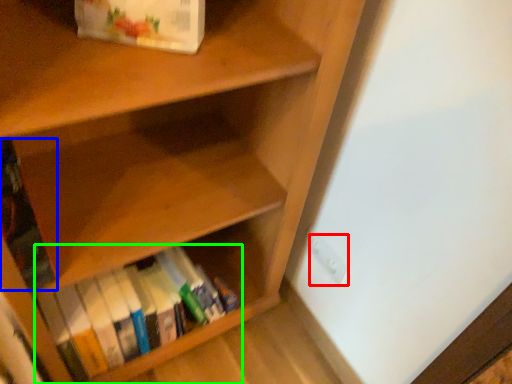
Question: Considering the real-world distances, which object is farthest from electric outlet (highlighted by a red box)? book (highlighted by a blue box) or book (highlighted by a green box)?

Choices:
 (A) book
 (B) book

Answer: (A)